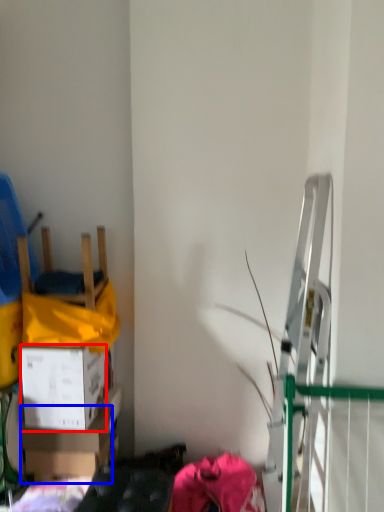
Question: Among these objects, which one is farthest to the camera, box (highlighted by a red box) or box (highlighted by a blue box)?

Choices:
 (A) box
 (B) box

Answer: (B)